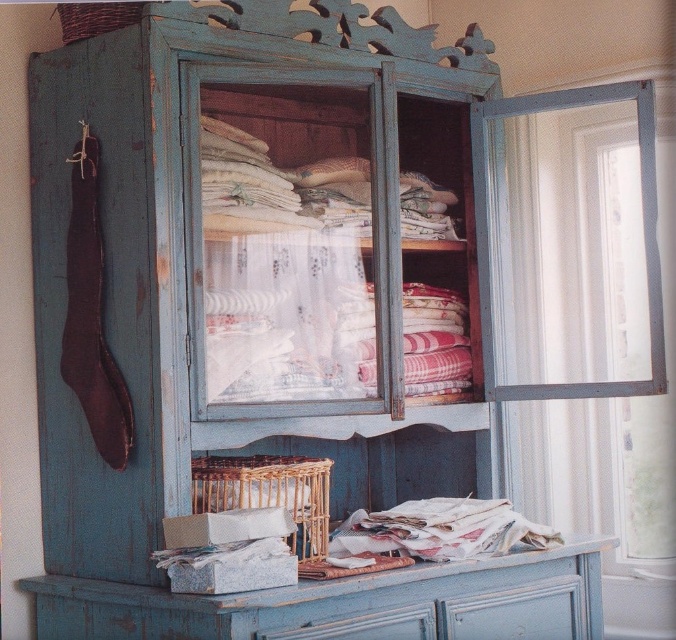
Question: Considering the real-world distances, which object is farthest from the distressed blue drawer at lower center?

Choices:
 (A) woven wicker basket at center
 (B) woven brown basket at upper left

Answer: (B)

Question: Which point is closer to the camera taking this photo?

Choices:
 (A) (68, 29)
 (B) (566, 608)
 (C) (324, 524)

Answer: (A)

Question: Among these objects, which one is nearest to the camera?

Choices:
 (A) woven wicker basket at center
 (B) woven brown basket at upper left

Answer: (A)

Question: Does woven wicker basket at center have a larger size compared to woven brown basket at upper left?

Choices:
 (A) yes
 (B) no

Answer: (A)

Question: Can you confirm if woven wicker basket at center is bigger than woven brown basket at upper left?

Choices:
 (A) no
 (B) yes

Answer: (B)

Question: Is woven wicker basket at center to the left of distressed blue drawer at lower center from the viewer's perspective?

Choices:
 (A) yes
 (B) no

Answer: (A)